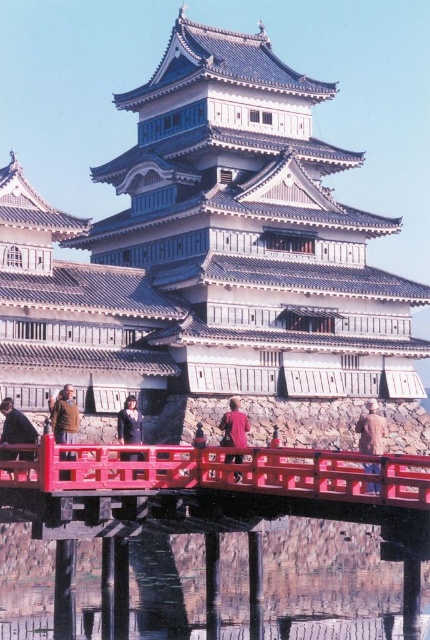
Question: Which object is closer to the camera taking this photo?

Choices:
 (A) dark blue fabric jacket at center
 (B) brown woolen coat at center-right

Answer: (B)

Question: Which object is closer to the camera taking this photo?

Choices:
 (A) dark blue fabric jacket at center
 (B) brown woolen coat at center-right
 (C) dark brown leather jacket at lower left

Answer: (B)

Question: Which of the following is the farthest from the observer?

Choices:
 (A) red fabric person at center
 (B) matte black person at center
 (C) brown woolen coat at center-right

Answer: (B)

Question: Is brown leather jacket at center behind dark brown leather jacket at lower left?

Choices:
 (A) no
 (B) yes

Answer: (A)

Question: Does stone gray stone palace at center appear on the right side of dark brown leather jacket at lower left?

Choices:
 (A) no
 (B) yes

Answer: (B)

Question: Can you confirm if stone gray stone palace at center is thinner than brown woolen coat at center-right?

Choices:
 (A) no
 (B) yes

Answer: (A)